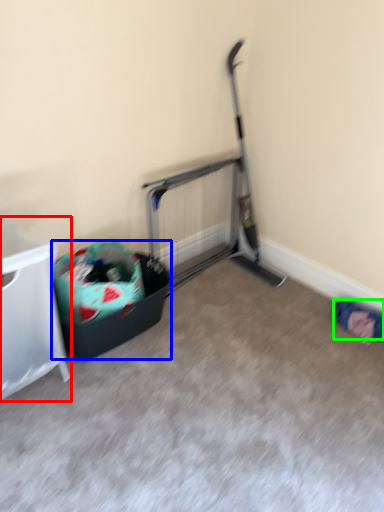
Question: Which object is positioned closest to furniture (highlighted by a red box)? Select from recycling bin (highlighted by a blue box) and clothing (highlighted by a green box).

Choices:
 (A) recycling bin
 (B) clothing

Answer: (A)